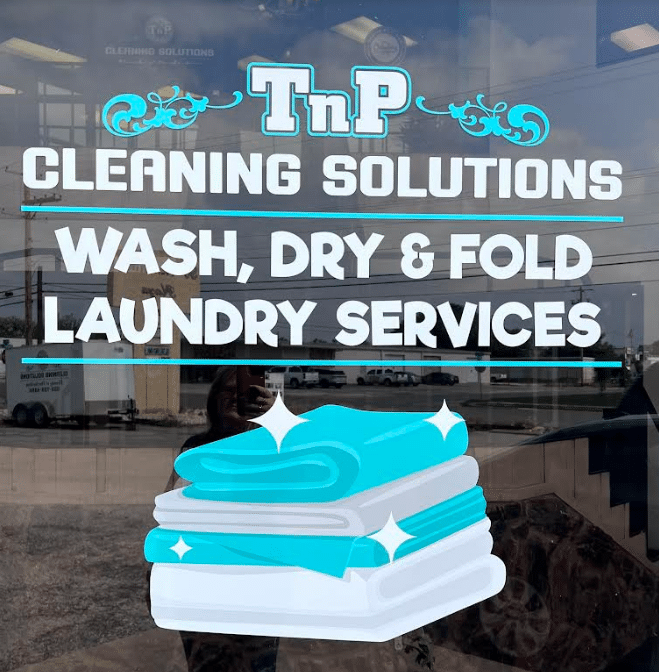
Where is `bath towel`? The width and height of the screenshot is (659, 672). bath towel is located at coordinates (310, 587).